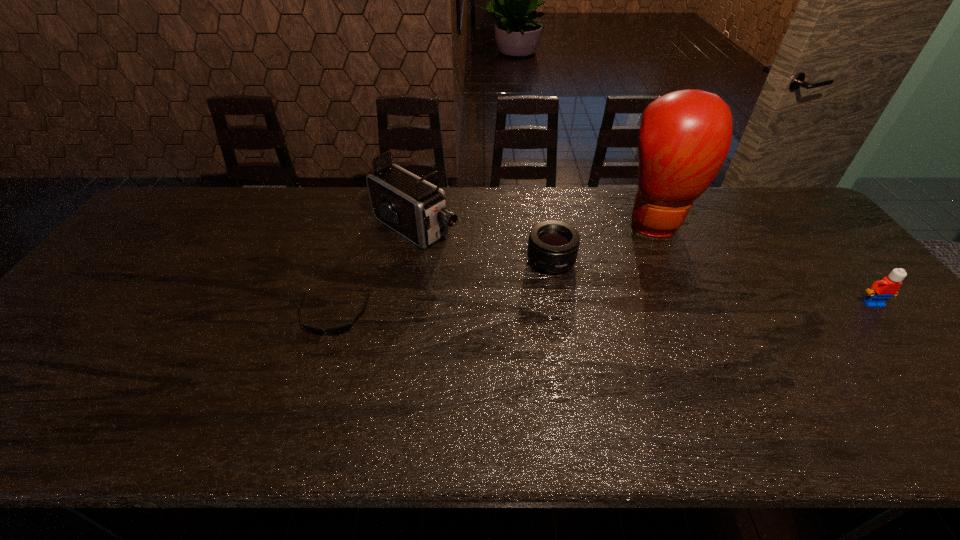
Where is `the shortest object`? The height and width of the screenshot is (540, 960). the shortest object is located at coordinates (335, 331).

Identify the location of the rightmost object. The height and width of the screenshot is (540, 960). (880, 291).

Where is `Lego`? This screenshot has height=540, width=960. Lego is located at coordinates (880, 291).

I want to click on the second shortest object, so click(553, 246).

Find the location of `the third object from right to left`. the third object from right to left is located at coordinates (553, 246).

You are a GUI agent. You are given a task and a screenshot of the screen. Output one action in this format:
    pyautogui.click(x=<x>, y=<y>)
    Task: Click on the second tallest object
    The width and height of the screenshot is (960, 540).
    Given the screenshot: What is the action you would take?
    pyautogui.click(x=416, y=209)

At what (x,y) coordinates should I click in order to perform the action: click on boxing glove. Please return your answer as a coordinate pair (x, y). The image size is (960, 540). Looking at the image, I should click on click(684, 138).

Where is `the second object from right to left`? the second object from right to left is located at coordinates (684, 138).

The image size is (960, 540). I want to click on vacant region located 0.120m on the front-facing side of the shortest object, so click(314, 380).

Locate an element on the screen. blank space located on the face of the rightmost object is located at coordinates (924, 363).